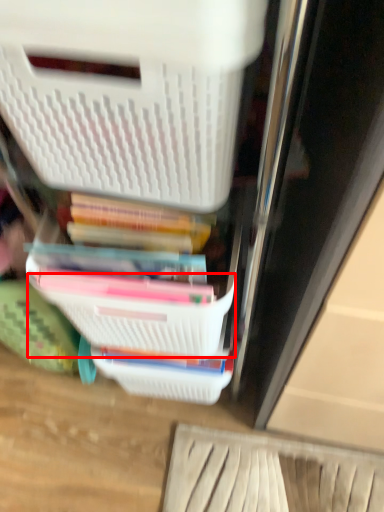
Question: From the image's perspective, what is the correct spatial relationship of basket (annotated by the red box) in relation to storage box?

Choices:
 (A) below
 (B) above

Answer: (A)